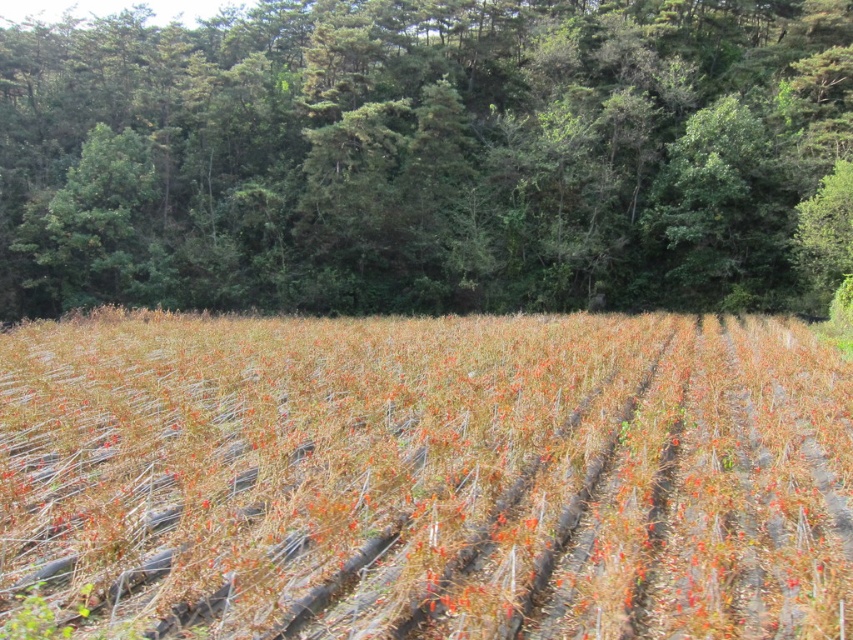
You are a farmer checking the health of your crops. You notice the brown dry grass at center and the green leafy tree at upper center. Which of these two has a wider spread in terms of their growth area?

The green leafy tree at upper center has a wider spread than the brown dry grass at center.

You are a farmer checking the health of your crops. You notice the brown dry grass at center and the green leafy tree at upper center. Which one is taller?

The brown dry grass at center is shorter than the green leafy tree at upper center, so the green leafy tree at upper center is taller.

You are a farmer checking the distance between your crops and the forest. You have a drone that can fly 25 meters. Can your drone reach the green leafy tree at upper center from the brown dry grass at center?

The distance between the brown dry grass at center and the green leafy tree at upper center is 26.66 meters. Since your drone can only fly 25 meters, it cannot reach the green leafy tree at upper center from the brown dry grass at center.